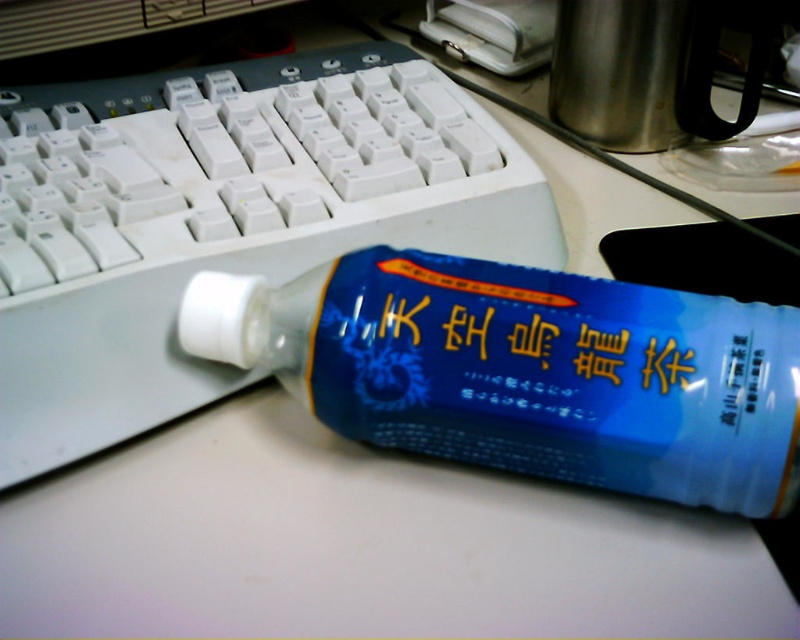
You are organizing your desk and need to place a new item between the white plastic keyboard at center and the blue plastic bottle at center. Based on their positions, which object should you place the item closer to if you want it to be on the left side of the desk?

You should place the item closer to the white plastic keyboard at center because it is already positioned to the left of the blue plastic bottle at center, so placing the item near it will keep it on the left side of the desk.

You are trying to reach a point in the workspace. You are currently at point (54, 113) and want to move towards point (277, 300). Will you be moving away from or closer to the viewer as you move?

Point (54, 113) is further to the viewer than point (277, 300). So moving from point (54, 113) to point (277, 300) means you are moving away from the viewer.

You are trying to locate the white plastic keyboard at center in the workspace. According to the coordinates provided, where exactly is it positioned?

The white plastic keyboard at center is positioned at the 2D coordinates point [220,220].